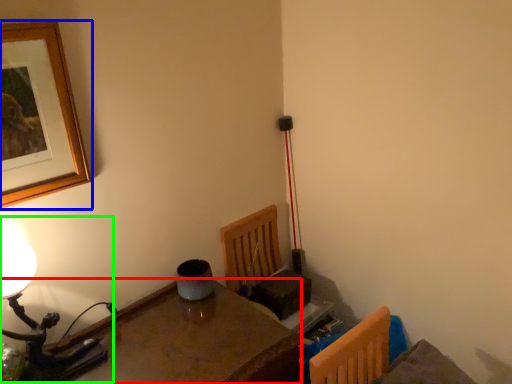
Question: Based on their relative distances, which object is nearer to table (highlighted by a red box)? Choose from picture frame (highlighted by a blue box) and table lamp (highlighted by a green box).

Choices:
 (A) picture frame
 (B) table lamp

Answer: (B)